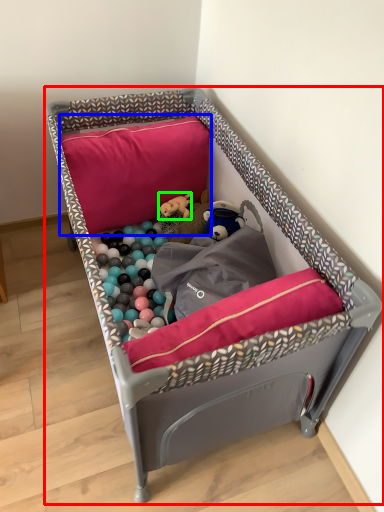
Question: Considering the real-world distances, which object is closest to infant bed (highlighted by a red box)? pillow (highlighted by a blue box) or toy (highlighted by a green box).

Choices:
 (A) pillow
 (B) toy

Answer: (A)